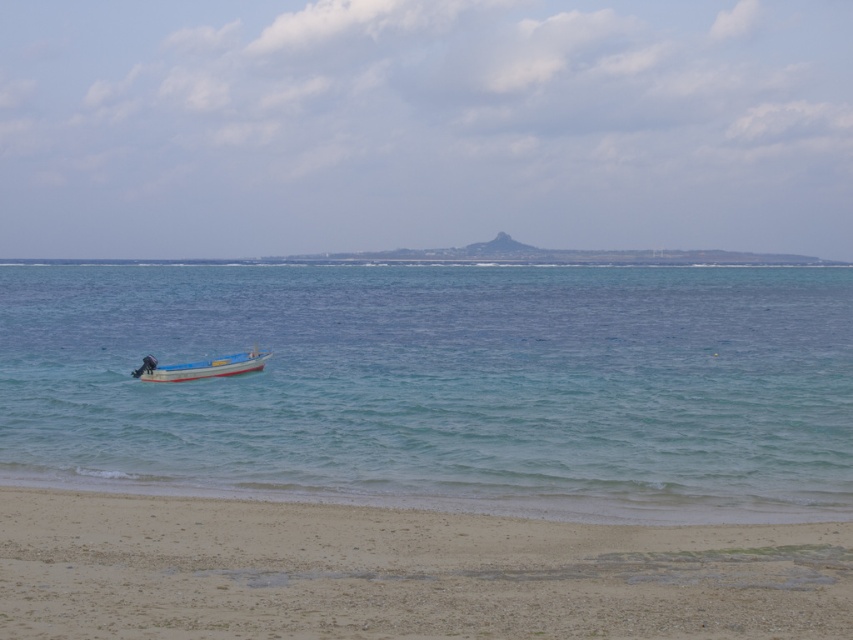
Question: Is clear blue water at center positioned at the back of sandy beach at lower center?

Choices:
 (A) no
 (B) yes

Answer: (B)

Question: Does clear blue water at center have a lesser width compared to light blue plastic boat at center?

Choices:
 (A) no
 (B) yes

Answer: (A)

Question: Which point appears farthest from the camera in this image?

Choices:
 (A) (x=646, y=348)
 (B) (x=167, y=540)
 (C) (x=144, y=356)
 (D) (x=251, y=369)

Answer: (A)

Question: Which object appears farthest from the camera in this image?

Choices:
 (A) dark blue fabric person at lower left
 (B) light blue plastic boat at center
 (C) clear blue water at center

Answer: (A)

Question: Which point is farther from the camera taking this photo?

Choices:
 (A) (244, 353)
 (B) (51, 634)

Answer: (A)

Question: Can you confirm if sandy beach at lower center is bigger than light blue plastic boat at center?

Choices:
 (A) no
 (B) yes

Answer: (A)